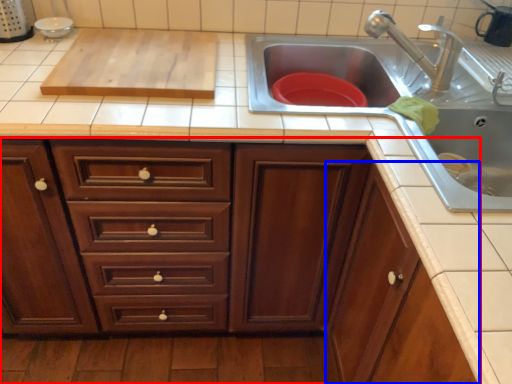
Question: Which point is further to the camera, cabinetry (highlighted by a red box) or cabinetry (highlighted by a blue box)?

Choices:
 (A) cabinetry
 (B) cabinetry

Answer: (B)